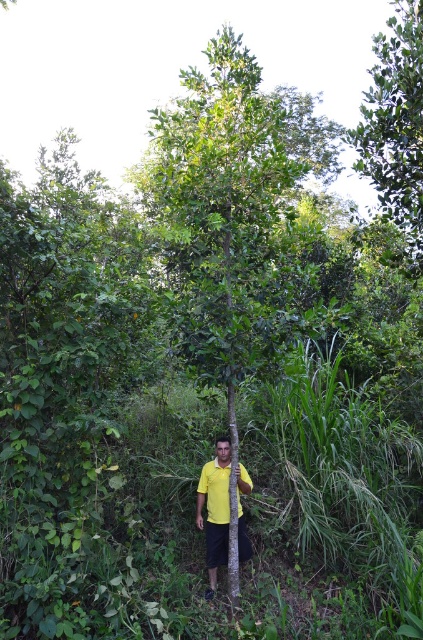
This screenshot has width=423, height=640. What do you see at coordinates (233, 211) in the screenshot?
I see `green matte tree at center` at bounding box center [233, 211].

Where is `green matte tree at center`? This screenshot has height=640, width=423. green matte tree at center is located at coordinates (233, 211).

Who is taller, green matte tree at center or yellow matte shirt at center?

green matte tree at center is taller.

Can you confirm if green matte tree at center is positioned below yellow matte shirt at center?

Incorrect, green matte tree at center is not positioned below yellow matte shirt at center.

I want to click on green matte tree at center, so click(233, 211).

Does green leafy tree at upper right have a greater height compared to yellow matte shirt at center?

Yes.

Looking at this image, is the position of green leafy tree at upper right less distant than that of yellow matte shirt at center?

No, green leafy tree at upper right is behind yellow matte shirt at center.

The width and height of the screenshot is (423, 640). Identify the location of green leafy tree at upper right. (395, 125).

Identify the location of green leafy tree at upper right. This screenshot has width=423, height=640. (395, 125).